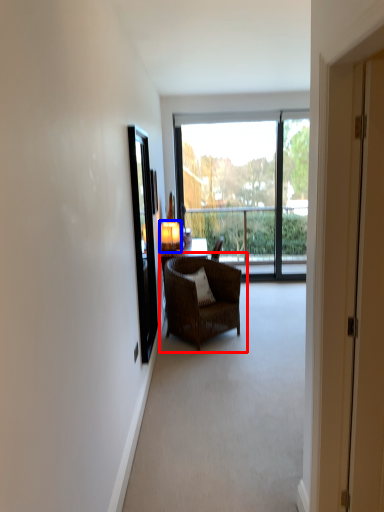
Question: Which object appears closest to the camera in this image, chair (highlighted by a red box) or lamp (highlighted by a blue box)?

Choices:
 (A) chair
 (B) lamp

Answer: (A)